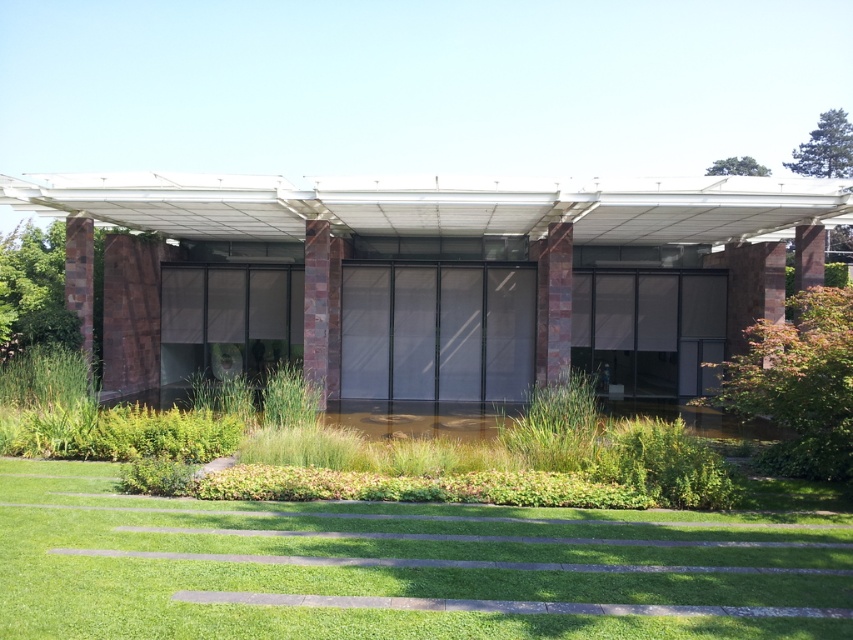
Is point (631, 385) positioned behind point (347, 573)?

Yes, point (631, 385) is behind point (347, 573).

Between point (529, 292) and point (80, 621), which one is positioned in front?

Point (80, 621) is more forward.

Locate an element on the screen. Image resolution: width=853 pixels, height=640 pixels. matte white pergola at center is located at coordinates (433, 280).

Locate an element on the screen. The height and width of the screenshot is (640, 853). matte white pergola at center is located at coordinates (433, 280).